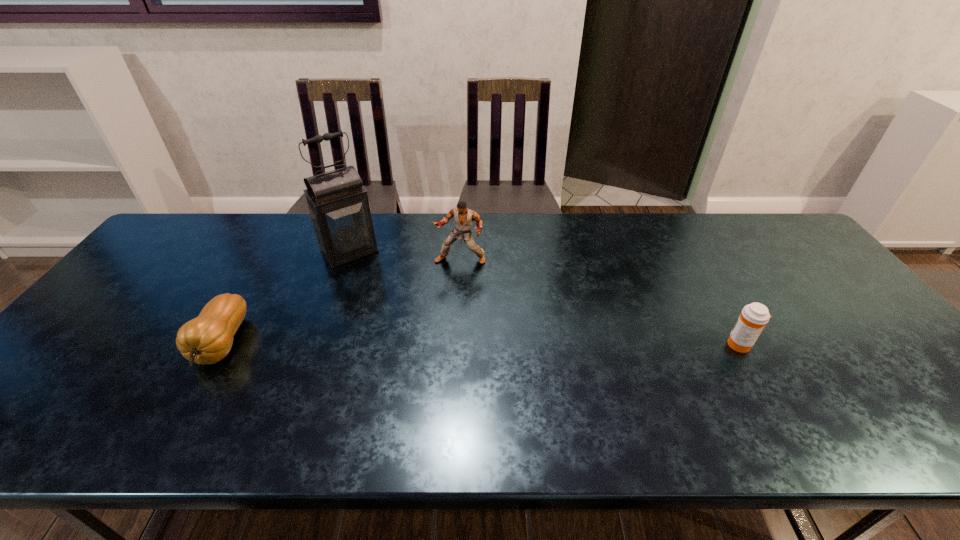
The height and width of the screenshot is (540, 960). What are the coordinates of `vacant space situated on the front-facing side of the third shortest object` in the screenshot? It's located at (427, 325).

Where is `free space located on the front-facing side of the third object from right to left`? This screenshot has height=540, width=960. free space located on the front-facing side of the third object from right to left is located at coordinates (390, 305).

Where is `vacant space located 0.160m on the front-facing side of the third object from right to left`? vacant space located 0.160m on the front-facing side of the third object from right to left is located at coordinates (384, 296).

In order to click on free space located 0.210m on the front-facing side of the third object from right to left in this screenshot , I will do `click(392, 307)`.

You are a GUI agent. You are given a task and a screenshot of the screen. Output one action in this format:
    pyautogui.click(x=<x>, y=<y>)
    Task: Click on the puncher present at the far edge
    Image resolution: width=960 pixels, height=540 pixels.
    Given the screenshot: What is the action you would take?
    pyautogui.click(x=463, y=217)

Locate an element on the screen. Image resolution: width=960 pixels, height=540 pixels. lantern that is at the far edge is located at coordinates (338, 206).

The image size is (960, 540). I want to click on object that is at the near edge, so click(x=208, y=338).

What are the coordinates of `free region at the far edge of the desktop` in the screenshot? It's located at (499, 219).

Find the location of a particular element. The height and width of the screenshot is (540, 960). vacant space at the near edge is located at coordinates (326, 392).

At what (x,y) coordinates should I click in order to perform the action: click on vacant space at the left edge of the desktop. Please return your answer as a coordinate pair (x, y). This screenshot has height=540, width=960. Looking at the image, I should click on (162, 278).